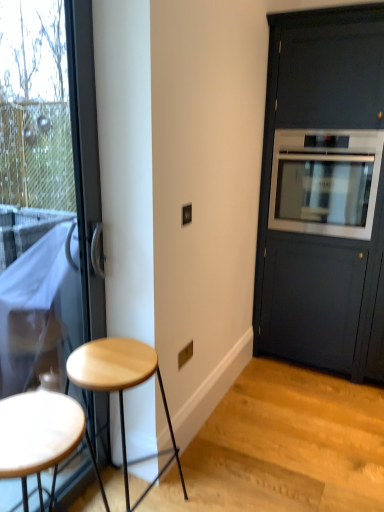
Question: Is wooden stool at left, which appears as the second stool when viewed from the back, in front of or behind matte black cabinet at right in the image?

Choices:
 (A) front
 (B) behind

Answer: (A)

Question: In terms of size, does wooden stool at left, which appears as the second stool when viewed from the back, appear bigger or smaller than matte black cabinet at right?

Choices:
 (A) small
 (B) big

Answer: (A)

Question: Considering the real-world distances, which object is farthest from the satin silver oven at right?

Choices:
 (A) transparent glass door at left
 (B) matte black cabinet at right
 (C) light wood stool at lower left, the second stool viewed from the front
 (D) wooden stool at left, marked as the first stool in a front-to-back arrangement

Answer: (D)

Question: Which is farther from the satin silver oven at right?

Choices:
 (A) transparent glass door at left
 (B) wooden stool at left, which appears as the second stool when viewed from the back
 (C) light wood stool at lower left, the second stool viewed from the front
 (D) matte black cabinet at right

Answer: (B)